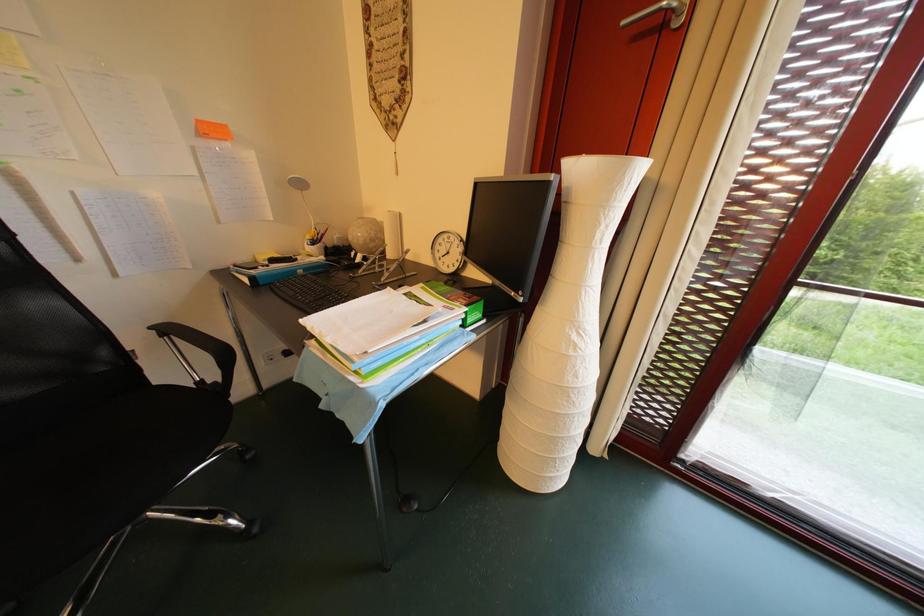
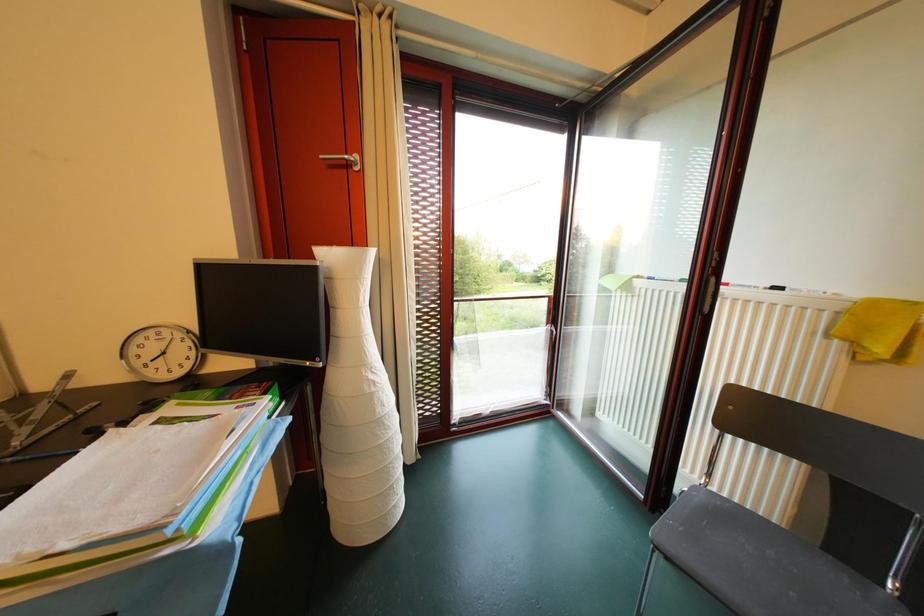
Question: The first image is from the beginning of the video and the second image is from the end. How did the camera likely rotate when shooting the video?

Choices:
 (A) Left
 (B) Right
 (C) Up
 (D) Down

Answer: (B)